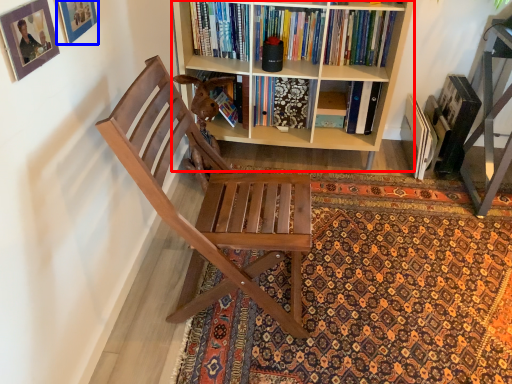
Question: Which point is closer to the camera, bookcase (highlighted by a red box) or picture frame (highlighted by a blue box)?

Choices:
 (A) bookcase
 (B) picture frame

Answer: (B)